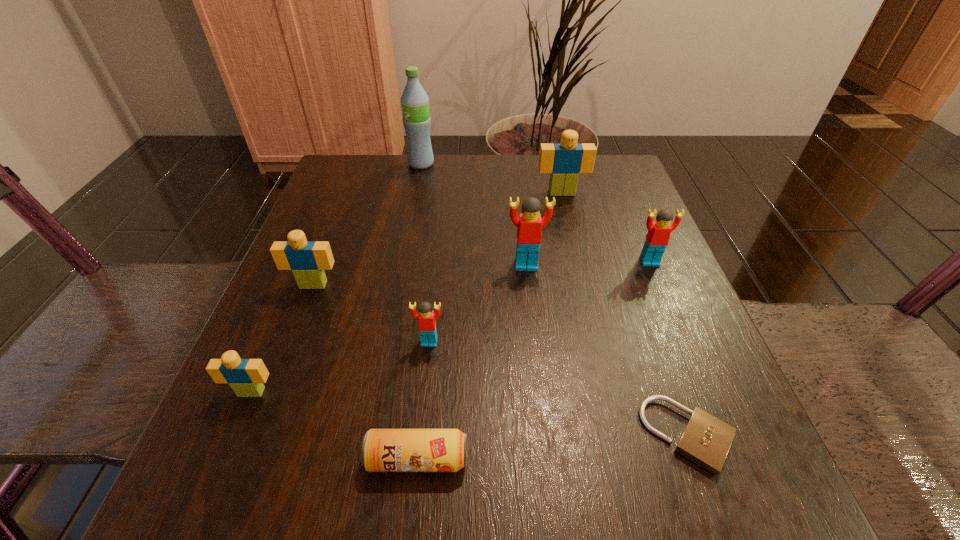
Image resolution: width=960 pixels, height=540 pixels. I want to click on free point located on the face of the second smallest beige Lego, so click(289, 349).

Identify the location of free space located 0.160m on the face of the rightmost Lego. The height and width of the screenshot is (540, 960). (679, 333).

The width and height of the screenshot is (960, 540). I want to click on free space located 0.240m on the face of the fourth nearest object, so click(x=412, y=508).

This screenshot has width=960, height=540. Find the location of `vacant area situated 0.100m on the face of the nearest Lego`. vacant area situated 0.100m on the face of the nearest Lego is located at coordinates (220, 468).

You are a GUI agent. You are given a task and a screenshot of the screen. Output one action in this format:
    pyautogui.click(x=<x>, y=<y>)
    Task: Click on the vacant region located on the right of the second shortest object
    The height and width of the screenshot is (540, 960).
    Given the screenshot: What is the action you would take?
    [719, 459]

Find the location of `vacant region located 0.110m on the back of the padlock`. vacant region located 0.110m on the back of the padlock is located at coordinates (654, 338).

Find the location of a particular element. The image size is (960, 540). water bottle that is at the far edge is located at coordinates click(x=415, y=102).

What are the coordinates of `Lego that is at the far edge` in the screenshot? It's located at (564, 161).

The width and height of the screenshot is (960, 540). In order to click on beer can that is at the near edge in this screenshot , I will do `click(383, 450)`.

At what (x,y) coordinates should I click in order to perform the action: click on padlock that is at the near edge. Please return your answer as a coordinate pair (x, y). Image resolution: width=960 pixels, height=540 pixels. Looking at the image, I should click on (706, 440).